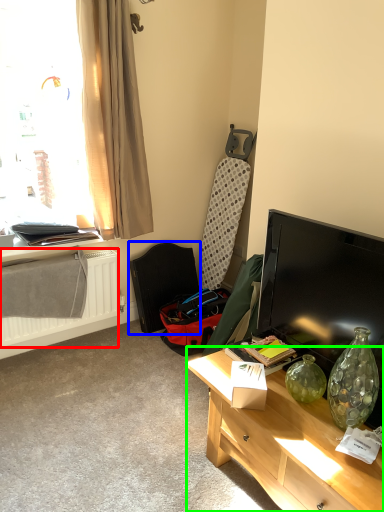
Question: Estimate the real-world distances between objects in this image. Which object is farther from radiator (highlighted by a red box), swivel chair (highlighted by a blue box) or desk (highlighted by a green box)?

Choices:
 (A) swivel chair
 (B) desk

Answer: (B)